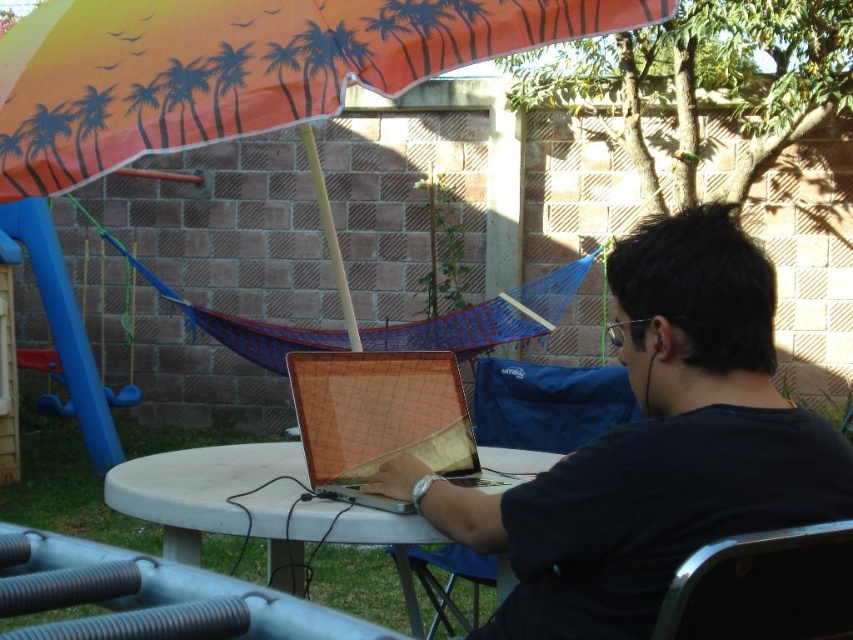
What do you see at coordinates (653, 445) in the screenshot? I see `black matte shirt at center` at bounding box center [653, 445].

The image size is (853, 640). Find the location of `black matte shirt at center`. black matte shirt at center is located at coordinates (653, 445).

Is point (527, 484) farther from camera compared to point (837, 588)?

Yes.

Can you confirm if black matte shirt at center is shorter than metallic silver chair at lower right?

No, black matte shirt at center is not shorter than metallic silver chair at lower right.

This screenshot has height=640, width=853. In order to click on black matte shirt at center in this screenshot , I will do `click(653, 445)`.

Looking at this image, is black matte shirt at center taller than metallic silver laptop at center?

Indeed, black matte shirt at center has a greater height compared to metallic silver laptop at center.

Is black matte shirt at center to the left of metallic silver laptop at center from the viewer's perspective?

Incorrect, black matte shirt at center is not on the left side of metallic silver laptop at center.

Is point (616, 452) positioned in front of point (376, 508)?

Yes, it is in front of point (376, 508).

The height and width of the screenshot is (640, 853). Identify the location of black matte shirt at center. (653, 445).